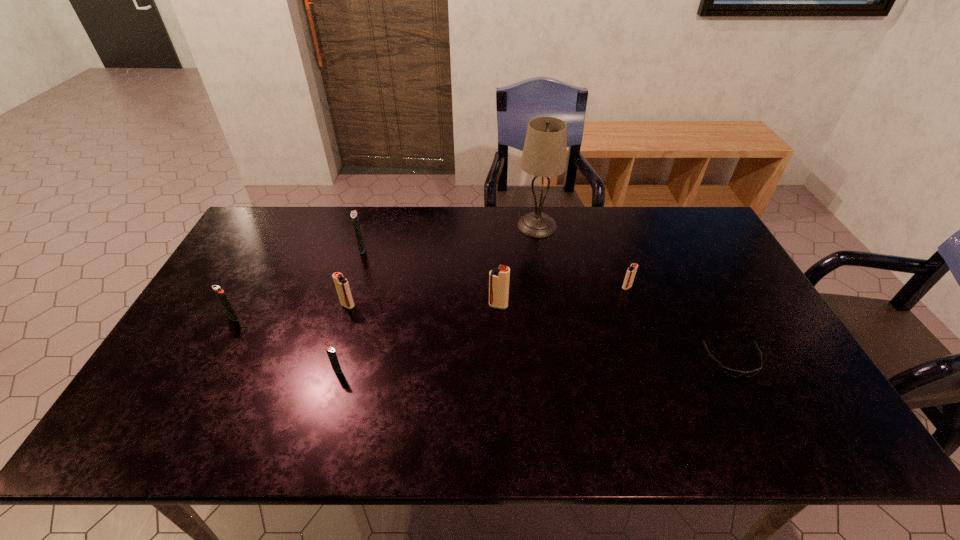
Identify which red igniter is located as the second nearest to the fifth igniter from left to right. Please provide its 2D coordinates. Your answer should be formatted as a tuple, i.e. [(x, y)], where the tuple contains the x and y coordinates of a point satisfying the conditions above.

[(342, 286)]

I want to click on red igniter that is the second closest to the second biggest red igniter, so click(x=630, y=274).

The width and height of the screenshot is (960, 540). Find the location of `black igniter that stands as the closest to the fifth object from left to right`. black igniter that stands as the closest to the fifth object from left to right is located at coordinates (331, 353).

Choose which black igniter is the second nearest neighbor to the biggest red igniter. Please provide its 2D coordinates. Your answer should be formatted as a tuple, i.e. [(x, y)], where the tuple contains the x and y coordinates of a point satisfying the conditions above.

[(354, 216)]

Find the location of a particular element. The image size is (960, 540). vacant area that satisfies the following two spatial constraints: 1. on the front side of the leftmost red igniter; 2. on the left side of the fifth igniter from left to right is located at coordinates (348, 306).

Where is `vacant space that satisfies the following two spatial constraints: 1. on the front side of the second smallest red igniter; 2. on the left side of the rightmost black igniter`? The width and height of the screenshot is (960, 540). vacant space that satisfies the following two spatial constraints: 1. on the front side of the second smallest red igniter; 2. on the left side of the rightmost black igniter is located at coordinates (328, 370).

Where is `free spot that satisfies the following two spatial constraints: 1. on the back side of the fifth farthest igniter; 2. on the left side of the second biggest red igniter`? The height and width of the screenshot is (540, 960). free spot that satisfies the following two spatial constraints: 1. on the back side of the fifth farthest igniter; 2. on the left side of the second biggest red igniter is located at coordinates (240, 305).